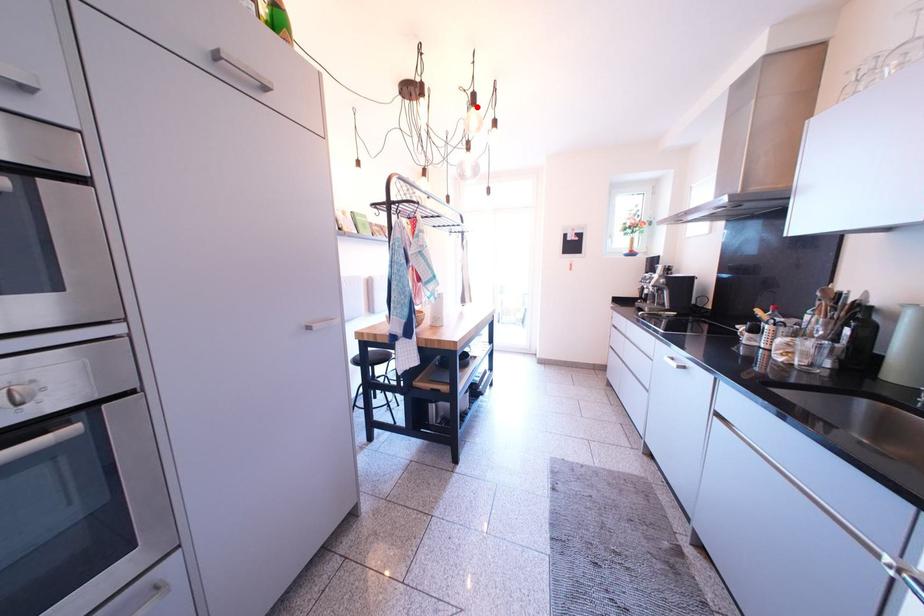
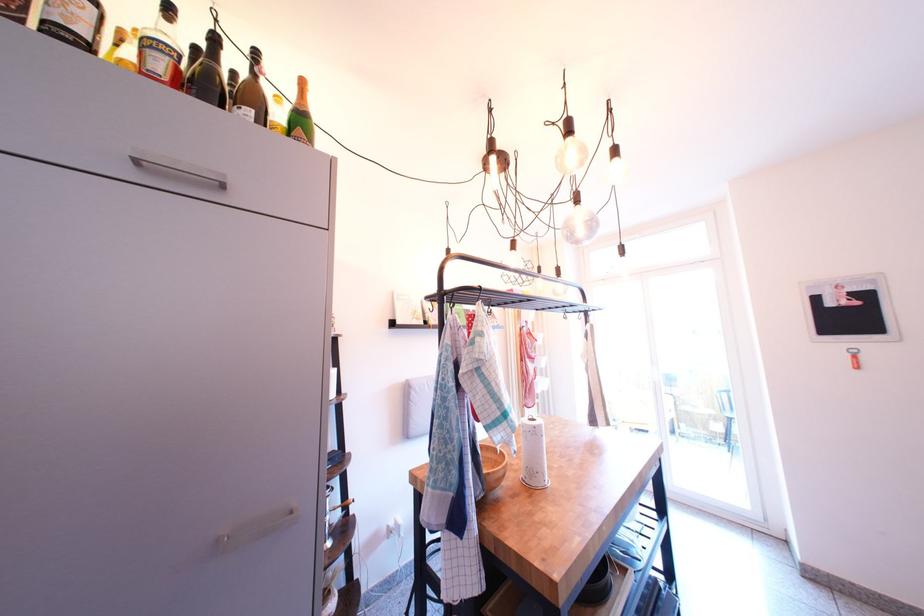
Locate, in the second image, the point that corresponds to the highlighted location in the first image.

(567, 140)